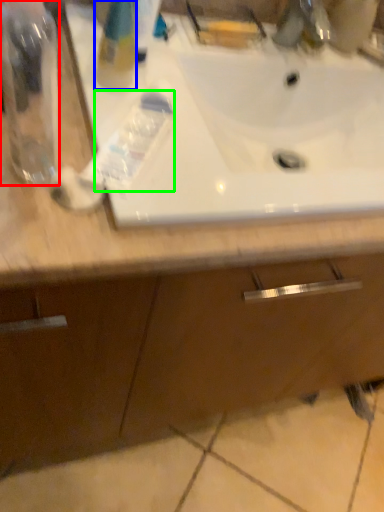
Question: Based on their relative distances, which object is nearer to bottle (highlighted by a red box)? Choose from cleaning product (highlighted by a blue box) and toothpaste (highlighted by a green box).

Choices:
 (A) cleaning product
 (B) toothpaste

Answer: (B)